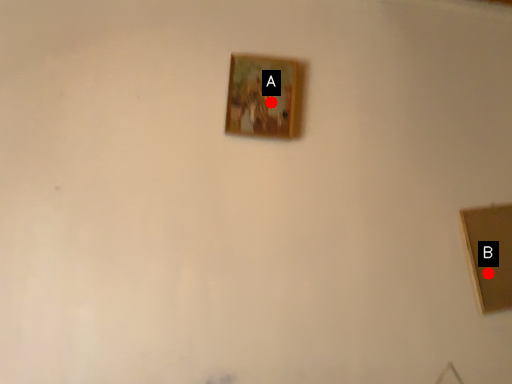
Question: Two points are circled on the image, labeled by A and B beside each circle. Which point is farther to the camera?

Choices:
 (A) A is further
 (B) B is further

Answer: (B)